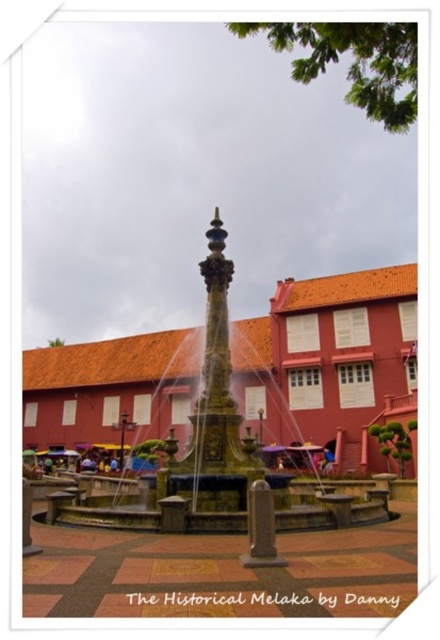
You are standing at the terracotta brick square at lower left and want to move to the brown wooden square at center. Which direction should you walk to reach it?

You should walk to your right since the brown wooden square at center is to the right of the terracotta brick square at lower left.

You are standing in the public square at Melaka Historical Site and see the bronze textured fountain at center and the brown wooden square at center. Which object is positioned higher from the ground?

The bronze textured fountain at center is above the brown wooden square at center, so it is positioned higher from the ground.

You are a tour guide explaining the layout of the square to visitors. You mention both the bronze textured fountain at center and the terracotta brick square at lower left. Which of these two landmarks is wider?

The bronze textured fountain at center is wider than the terracotta brick square at lower left.